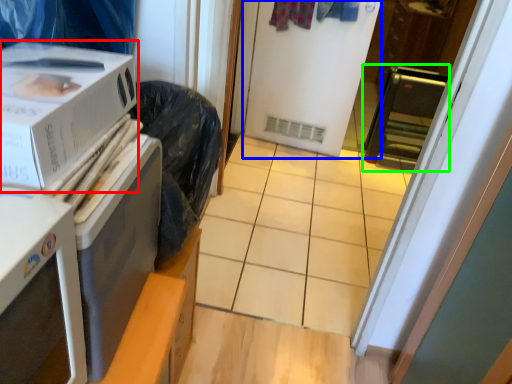
Question: Based on their relative distances, which object is nearer to home appliance (highlighted by a red box)? Choose from screen door (highlighted by a blue box) and appliance (highlighted by a green box).

Choices:
 (A) screen door
 (B) appliance

Answer: (A)